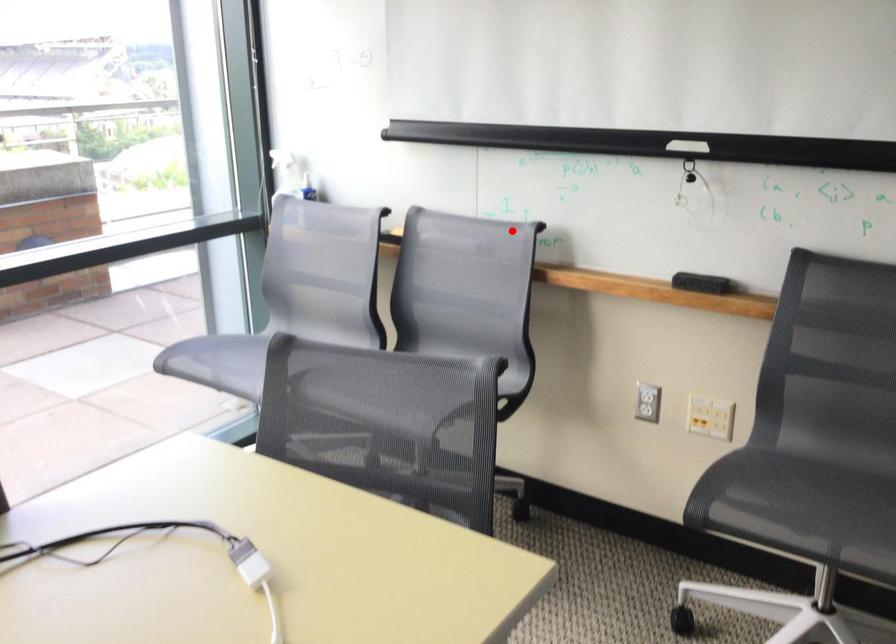
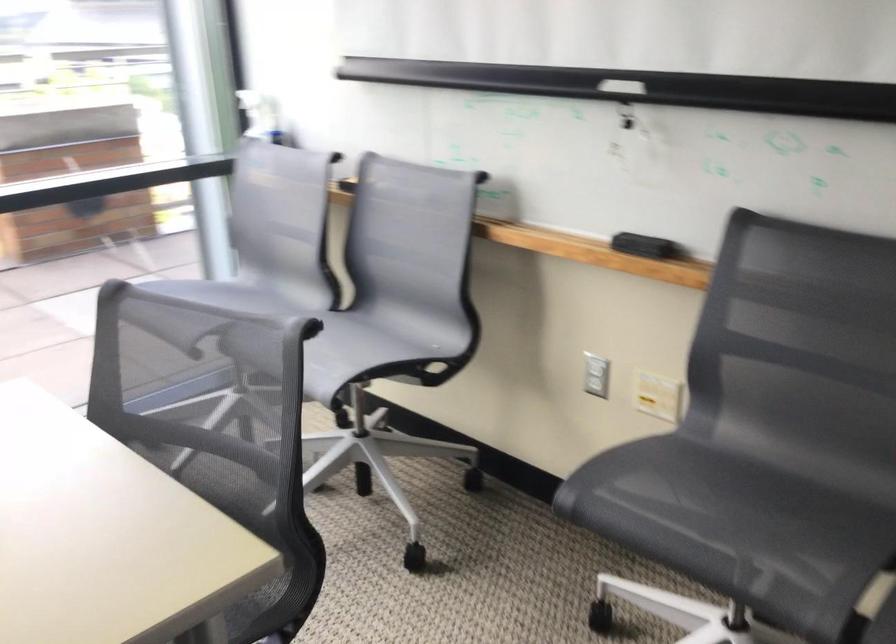
Question: I am providing you with two images of the same scene from different viewpoints. Given a red point in image1, look at the same physical point in image2. Is it:

Choices:
 (A) Closer to the viewpoint
 (B) Farther from the viewpoint

Answer: (A)